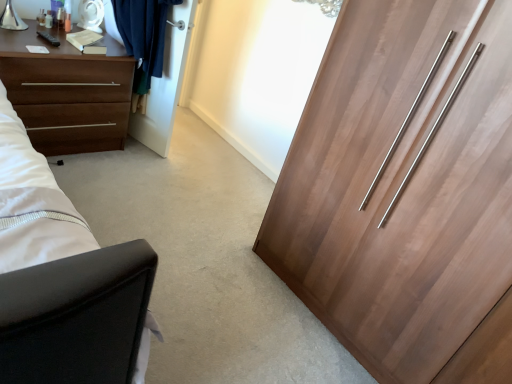
Question: Looking at the image, does brown matte chest of drawers at left seem bigger or smaller compared to white glossy door at upper center?

Choices:
 (A) small
 (B) big

Answer: (B)

Question: Considering the positions of point tap(46, 105) and point tap(164, 87), is point tap(46, 105) closer or farther from the camera than point tap(164, 87)?

Choices:
 (A) farther
 (B) closer

Answer: (B)

Question: Estimate the real-world distances between objects in this image. Which object is farther from the brown matte chest of drawers at left?

Choices:
 (A) white glossy door at upper center
 (B) wooden wardrobe at right

Answer: (B)

Question: Which of these objects is positioned farthest from the wooden wardrobe at right?

Choices:
 (A) white glossy door at upper center
 (B) brown matte chest of drawers at left

Answer: (B)